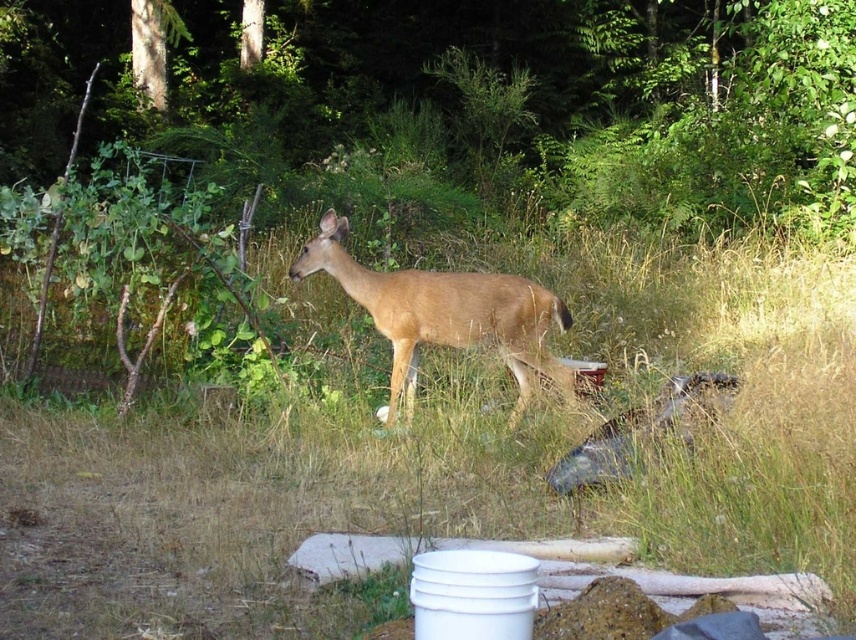
Question: Is green grass at center above brown matte/deer at center?

Choices:
 (A) yes
 (B) no

Answer: (B)

Question: Does green grass at center have a greater width compared to brown matte/deer at center?

Choices:
 (A) no
 (B) yes

Answer: (B)

Question: Is green grass at center positioned behind brown matte/deer at center?

Choices:
 (A) no
 (B) yes

Answer: (A)

Question: Which of the following is the closest to the observer?

Choices:
 (A) (440, 275)
 (B) (643, 304)

Answer: (A)